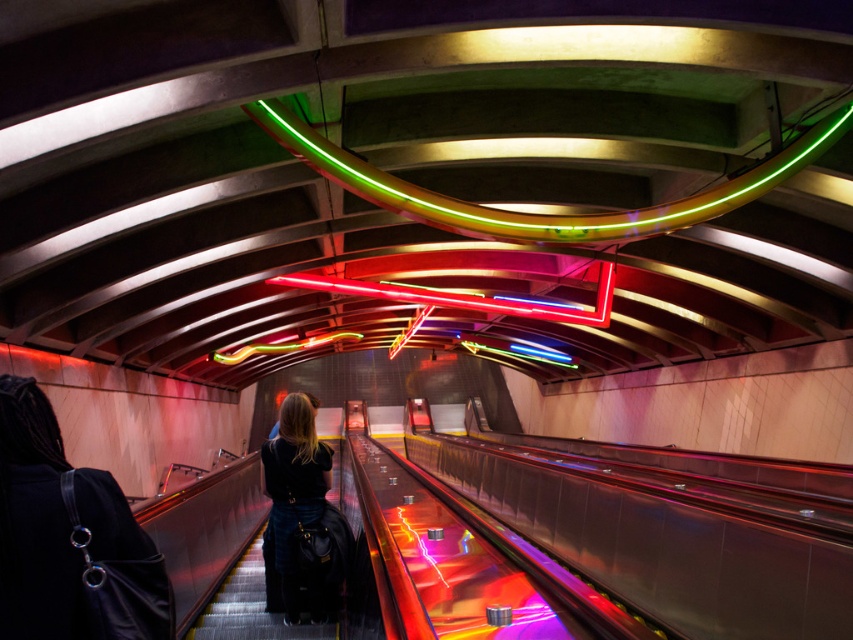
Consider the image. Does black leather jacket at lower left come in front of dark blue denim jeans at center?

That is True.

Between black leather jacket at lower left and dark blue denim jeans at center, which one appears on the right side from the viewer's perspective?

black leather jacket at lower left

Where is `black leather jacket at lower left`? This screenshot has width=853, height=640. black leather jacket at lower left is located at coordinates (68, 538).

The image size is (853, 640). Find the location of `black leather jacket at lower left`. black leather jacket at lower left is located at coordinates (68, 538).

Is the position of neon/glass tube at upper center more distant than that of dark blue denim jeans at center?

Yes, it is.

Between neon/glass tube at upper center and dark blue denim jeans at center, which one appears on the right side from the viewer's perspective?

From the viewer's perspective, neon/glass tube at upper center appears more on the right side.

The image size is (853, 640). In order to click on neon/glass tube at upper center in this screenshot , I will do `click(540, 214)`.

Which is behind, point (131, 589) or point (486, 227)?

Positioned behind is point (486, 227).

Can you confirm if black leather jacket at lower left is taller than neon/glass tube at upper center?

No.

Who is more distant from viewer, (149, 593) or (271, 125)?

Positioned behind is point (271, 125).

Find the location of `black leather jacket at lower left`. black leather jacket at lower left is located at coordinates (68, 538).